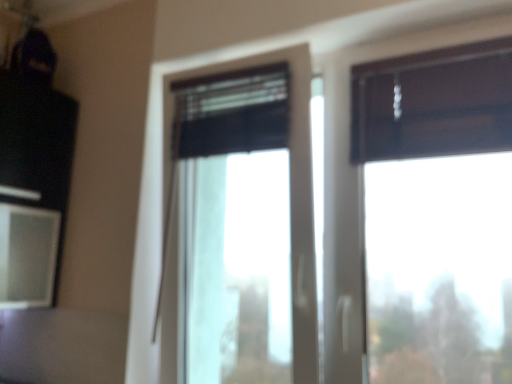
Question: Is dark wood window at upper right, which appears as the first window when viewed from the right, in contact with black matte window at center, which appears as the first window when viewed from the left?

Choices:
 (A) no
 (B) yes

Answer: (A)

Question: From the image's perspective, does dark wood window at upper right, which is counted as the 2th window, starting from the left, appear higher than black matte window at center, arranged as the 2th window when viewed from the right?

Choices:
 (A) yes
 (B) no

Answer: (A)

Question: From a real-world perspective, is dark wood window at upper right, which appears as the first window when viewed from the right, below black matte window at center, arranged as the 2th window when viewed from the right?

Choices:
 (A) yes
 (B) no

Answer: (B)

Question: Is dark wood window at upper right, which appears as the first window when viewed from the right, positioned in front of black matte window at center, arranged as the 2th window when viewed from the right?

Choices:
 (A) yes
 (B) no

Answer: (A)

Question: Is dark wood window at upper right, which is counted as the 2th window, starting from the left, oriented away from black matte window at center, which appears as the first window when viewed from the left?

Choices:
 (A) no
 (B) yes

Answer: (A)

Question: Is dark wood window at upper right, which is counted as the 2th window, starting from the left, in front of or behind black matte window at center, which appears as the first window when viewed from the left, in the image?

Choices:
 (A) behind
 (B) front

Answer: (B)

Question: Considering the positions of dark wood window at upper right, which appears as the first window when viewed from the right, and black matte window at center, arranged as the 2th window when viewed from the right, in the image, is dark wood window at upper right, which appears as the first window when viewed from the right, taller or shorter than black matte window at center, arranged as the 2th window when viewed from the right,?

Choices:
 (A) short
 (B) tall

Answer: (A)

Question: Which is correct: dark wood window at upper right, which appears as the first window when viewed from the right, is inside black matte window at center, arranged as the 2th window when viewed from the right, or outside of it?

Choices:
 (A) inside
 (B) outside

Answer: (B)

Question: From a real-world perspective, is dark wood window at upper right, which appears as the first window when viewed from the right, above or below black matte window at center, which appears as the first window when viewed from the left?

Choices:
 (A) above
 (B) below

Answer: (A)

Question: Which is correct: matte white screen at left is inside black matte window at center, which appears as the first window when viewed from the left, or outside of it?

Choices:
 (A) inside
 (B) outside

Answer: (B)

Question: Looking at the image, does matte white screen at left seem bigger or smaller compared to black matte window at center, which appears as the first window when viewed from the left?

Choices:
 (A) small
 (B) big

Answer: (A)

Question: Considering the positions of point (44, 254) and point (163, 304), is point (44, 254) closer or farther from the camera than point (163, 304)?

Choices:
 (A) closer
 (B) farther

Answer: (B)

Question: Relative to black matte window at center, arranged as the 2th window when viewed from the right, is matte white screen at left in front or behind?

Choices:
 (A) front
 (B) behind

Answer: (B)

Question: Which is correct: black matte window at center, which appears as the first window when viewed from the left, is inside matte white screen at left, or outside of it?

Choices:
 (A) inside
 (B) outside

Answer: (B)

Question: Relative to matte white screen at left, is black matte window at center, which appears as the first window when viewed from the left, in front or behind?

Choices:
 (A) front
 (B) behind

Answer: (A)